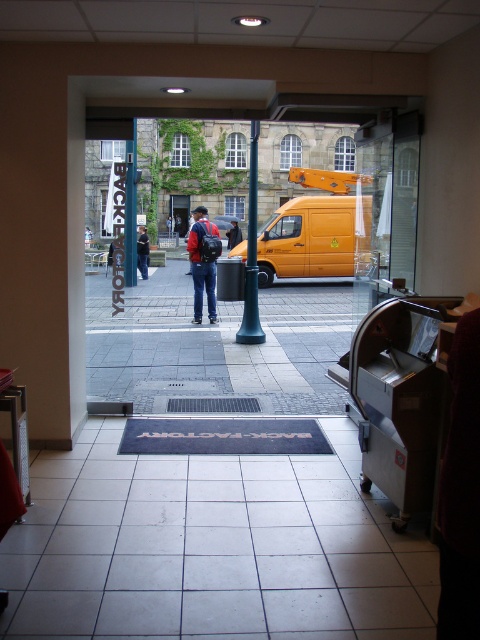
Is white tile pavement at center behind gray tile pavement at center?

No, white tile pavement at center is in front of gray tile pavement at center.

Is point (307, 627) in front of point (321, 305)?

Yes, it is in front of point (321, 305).

Which is behind, point (86, 486) or point (156, 406)?

The point (156, 406) is more distant.

Identify the location of white tile pavement at center. Image resolution: width=480 pixels, height=640 pixels. (212, 548).

Is point (132, 317) in front of point (230, 228)?

Yes, it is in front of point (230, 228).

Is point (222, 380) in front of point (238, 228)?

Yes.

Where is `gray tile pavement at center`? Image resolution: width=480 pixels, height=640 pixels. gray tile pavement at center is located at coordinates (217, 344).

Is gray tile pavement at center wider than matte red backpack at center?

Correct, the width of gray tile pavement at center exceeds that of matte red backpack at center.

Is point (214, 337) positioned before point (136, 246)?

Yes, point (214, 337) is closer to viewer.

Identify the location of gray tile pavement at center. The image size is (480, 640). (217, 344).